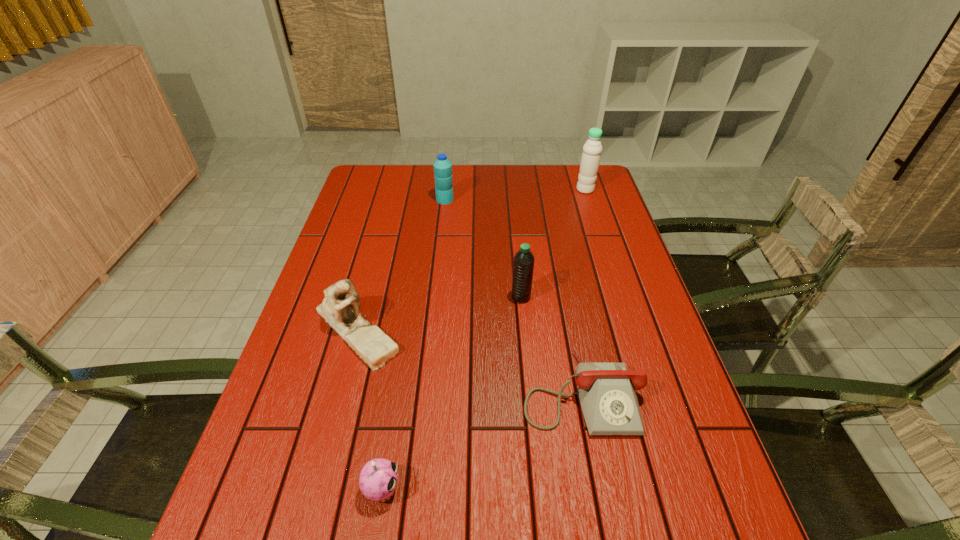
Identify the location of the farthest object. This screenshot has width=960, height=540. (592, 149).

This screenshot has height=540, width=960. In order to click on the tallest object in this screenshot , I will do `click(592, 149)`.

You are a GUI agent. You are given a task and a screenshot of the screen. Output one action in this format:
    pyautogui.click(x=<x>, y=<y>)
    Task: Click on the nearest water bottle
    The height and width of the screenshot is (540, 960).
    Given the screenshot: What is the action you would take?
    pyautogui.click(x=523, y=266)

At what (x,y) coordinates should I click in order to perform the action: click on the second farthest object. Please return your answer as a coordinate pair (x, y). Looking at the image, I should click on (442, 166).

You are a GUI agent. You are given a task and a screenshot of the screen. Output one action in this format:
    pyautogui.click(x=<x>, y=<y>)
    Task: Click on the leftmost water bottle
    
    Given the screenshot: What is the action you would take?
    pyautogui.click(x=442, y=166)

The height and width of the screenshot is (540, 960). I want to click on figurine, so click(x=340, y=308).

Where is `the fifth tallest object`? The height and width of the screenshot is (540, 960). the fifth tallest object is located at coordinates (378, 477).

The image size is (960, 540). In order to click on cupcake in this screenshot , I will do `click(378, 477)`.

Identify the location of the shortest object. (607, 394).

Where is `vacant space positioned 0.310m on the left of the rightmost water bottle`? This screenshot has width=960, height=540. vacant space positioned 0.310m on the left of the rightmost water bottle is located at coordinates click(x=492, y=190).